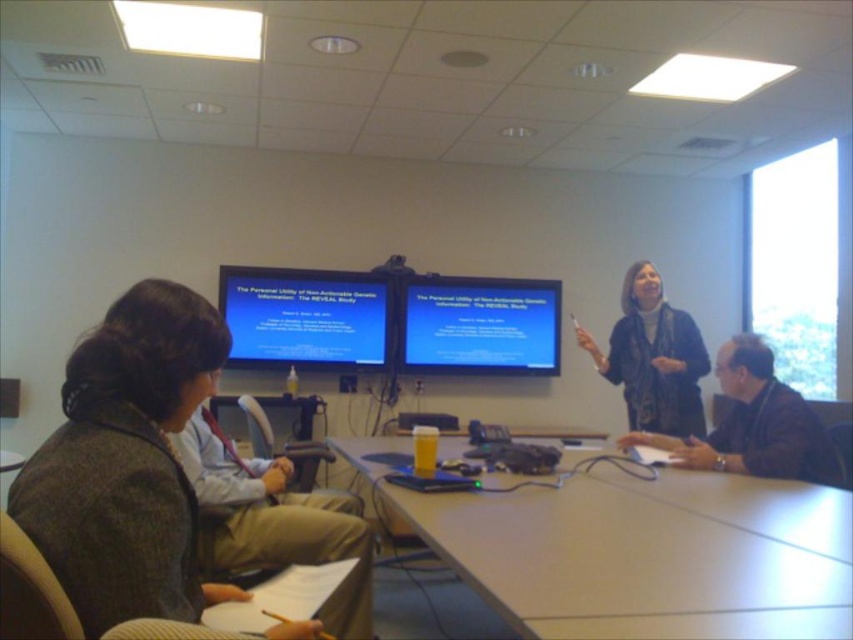
Question: Considering the relative positions of dark gray wool jacket at lower left and matte black scarf at upper right in the image provided, where is dark gray wool jacket at lower left located with respect to matte black scarf at upper right?

Choices:
 (A) left
 (B) right

Answer: (A)

Question: Which object is positioned farthest from the matte black screen at upper center?

Choices:
 (A) brown leather jacket at right
 (B) matte black scarf at upper right

Answer: (A)

Question: Which of the following is the closest to the observer?

Choices:
 (A) dark gray wool jacket at lower left
 (B) brown leather jacket at right
 (C) matte black screen at upper center

Answer: (A)

Question: From the image, what is the correct spatial relationship of dark gray wool jacket at lower left in relation to blue glossy projector screen at center?

Choices:
 (A) left
 (B) right

Answer: (A)

Question: Can you confirm if matte black screen at upper center is positioned to the left of blue glossy projector screen at center?

Choices:
 (A) no
 (B) yes

Answer: (B)

Question: Which point is farther to the camera?

Choices:
 (A) (415, 353)
 (B) (276, 314)
 (C) (759, 579)
 (D) (97, 388)

Answer: (A)